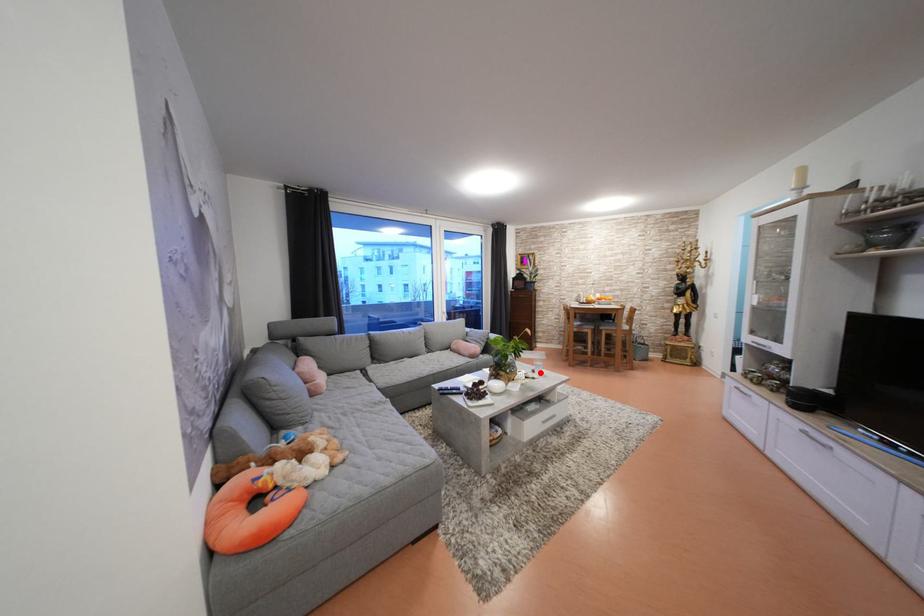
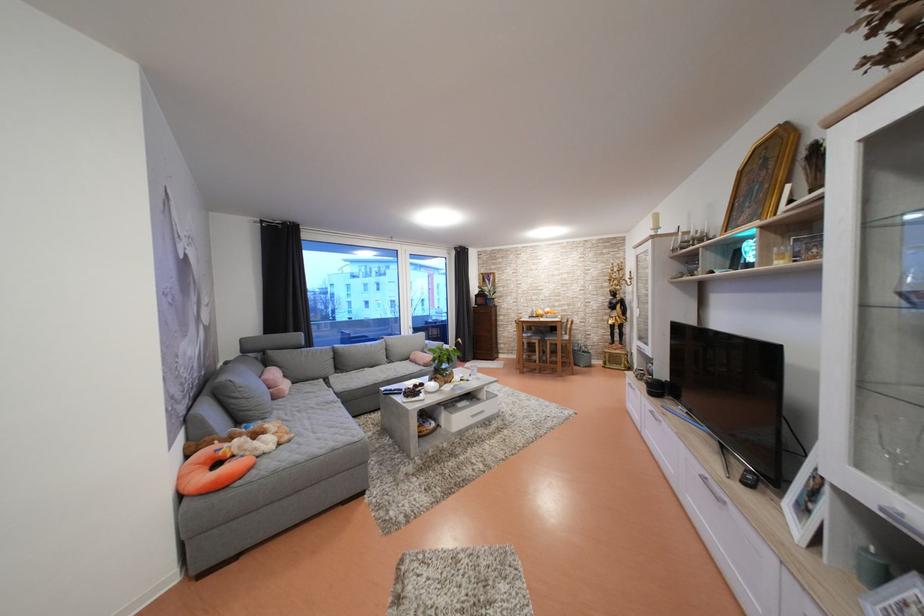
Question: I am providing you with two images of the same scene from different viewpoints. Given a red point in image1, look at the same physical point in image2. Is it:

Choices:
 (A) Closer to the viewpoint
 (B) Farther from the viewpoint

Answer: (A)